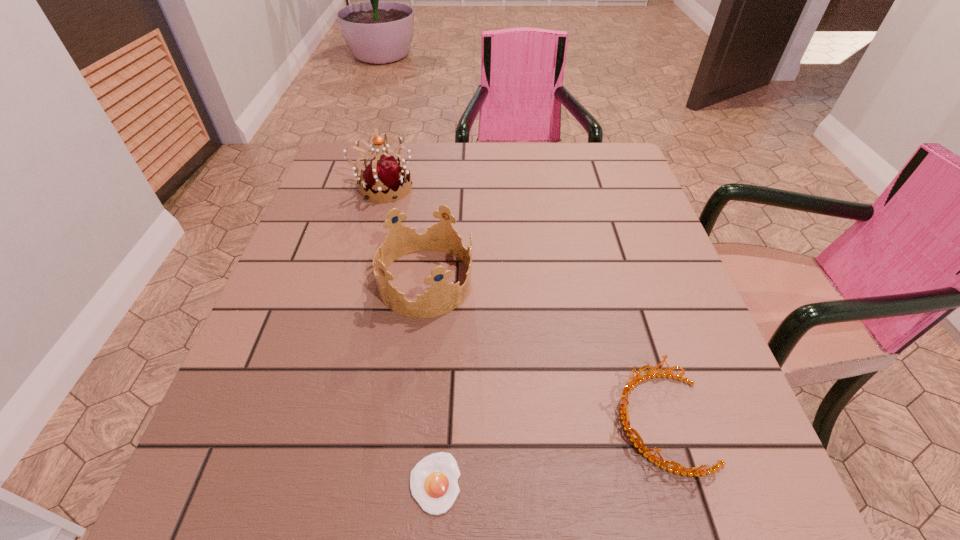
The image size is (960, 540). In order to click on vacant space at the far edge of the desktop in this screenshot , I will do `click(413, 164)`.

Where is `free space at the left edge`? This screenshot has height=540, width=960. free space at the left edge is located at coordinates [319, 390].

This screenshot has height=540, width=960. In the image, there is a desktop. Identify the location of vacant space at the right edge. (598, 231).

The width and height of the screenshot is (960, 540). In the image, there is a desktop. What are the coordinates of `vacant space at the far left corner` in the screenshot? It's located at (339, 170).

The height and width of the screenshot is (540, 960). I want to click on vacant space at the far right corner of the desktop, so click(x=590, y=173).

You are a GUI agent. You are given a task and a screenshot of the screen. Output one action in this format:
    pyautogui.click(x=<x>, y=<y>)
    Task: Click on the vacant region at the near right corner of the desktop
    
    Given the screenshot: What is the action you would take?
    pyautogui.click(x=763, y=488)

Find the location of a particular element. free space that is in between the rightmost object and the farthest object is located at coordinates (522, 305).

The image size is (960, 540). I want to click on free area in between the shortest object and the second tallest tiara, so click(430, 382).

The width and height of the screenshot is (960, 540). In order to click on free space between the tallest object and the rightmost object in this screenshot , I will do `click(522, 305)`.

The width and height of the screenshot is (960, 540). What are the coordinates of `free spot between the rightmost tiara and the second nearest tiara` in the screenshot? It's located at (543, 352).